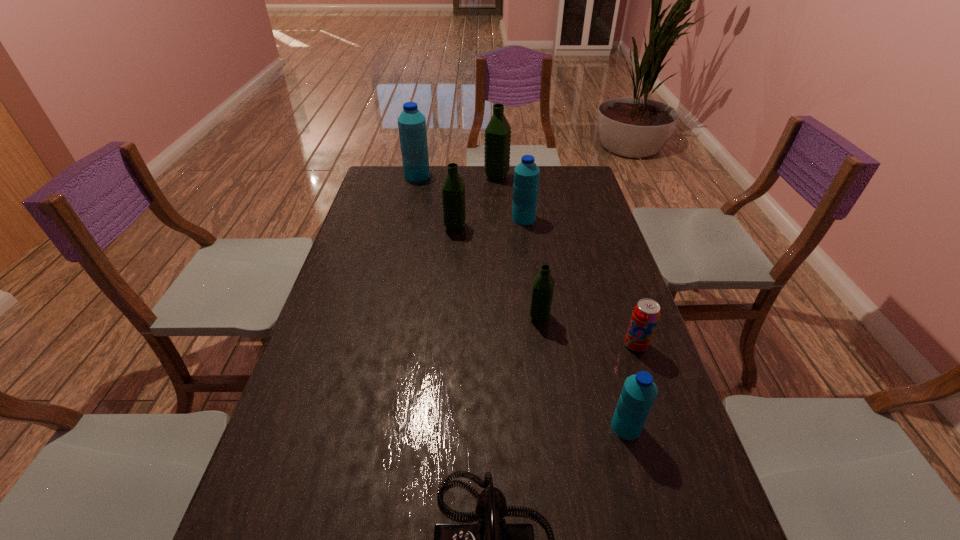
Find the location of a particular element. the seventh farthest object is located at coordinates [639, 391].

I want to click on the rightmost blue water bottle, so click(639, 391).

Locate an element on the screen. Image resolution: width=960 pixels, height=540 pixels. soda can is located at coordinates (646, 313).

Where is `the rightmost object`? The width and height of the screenshot is (960, 540). the rightmost object is located at coordinates (646, 313).

You are a GUI agent. You are given a task and a screenshot of the screen. Output one action in this format:
    pyautogui.click(x=<x>, y=<y>)
    Task: Click on the vacant space located on the front of the biggest green water bottle
    
    Given the screenshot: What is the action you would take?
    pos(498,208)

This screenshot has width=960, height=540. I want to click on vacant space situated on the right of the leftmost object, so click(475, 176).

Identify the location of vacant area located 0.090m on the left of the second blue water bottle from right to left. (488, 218).

This screenshot has width=960, height=540. I want to click on vacant space located 0.280m on the left of the fifth water bottle from right to left, so click(366, 227).

Locate an element on the screen. The image size is (960, 540). blank area located on the back of the nearest green water bottle is located at coordinates (534, 277).

Image resolution: width=960 pixels, height=540 pixels. Identify the location of vacant space located on the left of the smallest blue water bottle. (468, 427).